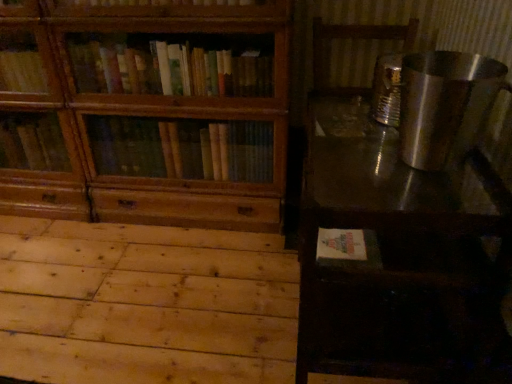
Question: From a real-world perspective, does natural wood plywood at lower left sit lower than wooden bookcase at left?

Choices:
 (A) no
 (B) yes

Answer: (B)

Question: From a real-world perspective, is natural wood plywood at lower left on top of wooden bookcase at left?

Choices:
 (A) no
 (B) yes

Answer: (A)

Question: Is natural wood plywood at lower left with wooden bookcase at left?

Choices:
 (A) no
 (B) yes

Answer: (A)

Question: Are natural wood plywood at lower left and wooden bookcase at left far apart?

Choices:
 (A) yes
 (B) no

Answer: (B)

Question: Considering the relative positions of natural wood plywood at lower left and wooden bookcase at left in the image provided, is natural wood plywood at lower left behind wooden bookcase at left?

Choices:
 (A) no
 (B) yes

Answer: (A)

Question: Can you confirm if natural wood plywood at lower left is positioned to the left of wooden bookcase at left?

Choices:
 (A) no
 (B) yes

Answer: (A)

Question: Is metallic reflective table at right at the back of natural wood plywood at lower left?

Choices:
 (A) yes
 (B) no

Answer: (B)

Question: Is natural wood plywood at lower left directly adjacent to metallic reflective table at right?

Choices:
 (A) yes
 (B) no

Answer: (B)

Question: Is natural wood plywood at lower left positioned beyond the bounds of metallic reflective table at right?

Choices:
 (A) yes
 (B) no

Answer: (A)

Question: Is the depth of natural wood plywood at lower left greater than that of metallic reflective table at right?

Choices:
 (A) no
 (B) yes

Answer: (B)

Question: Could you tell me if natural wood plywood at lower left is facing metallic reflective table at right?

Choices:
 (A) yes
 (B) no

Answer: (B)

Question: Can you confirm if natural wood plywood at lower left is taller than metallic reflective table at right?

Choices:
 (A) yes
 (B) no

Answer: (B)

Question: Is metallic reflective table at right aimed at natural wood plywood at lower left?

Choices:
 (A) no
 (B) yes

Answer: (B)